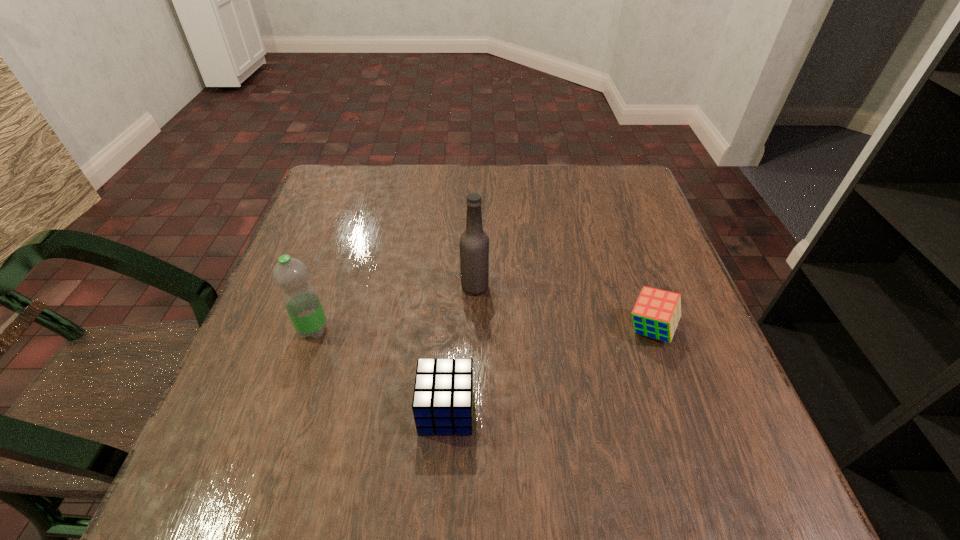
Identify the location of the farthest object. The width and height of the screenshot is (960, 540). (474, 242).

In order to click on the tallest object in this screenshot , I will do `click(474, 242)`.

You are a GUI agent. You are given a task and a screenshot of the screen. Output one action in this format:
    pyautogui.click(x=<x>, y=<y>)
    Task: Click on the leftmost object
    The height and width of the screenshot is (540, 960).
    Given the screenshot: What is the action you would take?
    pyautogui.click(x=301, y=301)

Image resolution: width=960 pixels, height=540 pixels. In order to click on water bottle in this screenshot , I will do `click(301, 301)`.

Locate an element on the screen. This screenshot has height=540, width=960. the right cube is located at coordinates (656, 314).

Where is `the rightmost object`? This screenshot has width=960, height=540. the rightmost object is located at coordinates (656, 314).

Image resolution: width=960 pixels, height=540 pixels. What are the coordinates of `the nearer cube` in the screenshot? It's located at (442, 404).

Locate an element on the screen. the left cube is located at coordinates [x=442, y=404].

Where is `free space located on the side of the tallest object with the label`? Image resolution: width=960 pixels, height=540 pixels. free space located on the side of the tallest object with the label is located at coordinates (605, 287).

Find the location of a particular element. vacant space situated on the right of the third shortest object is located at coordinates (372, 329).